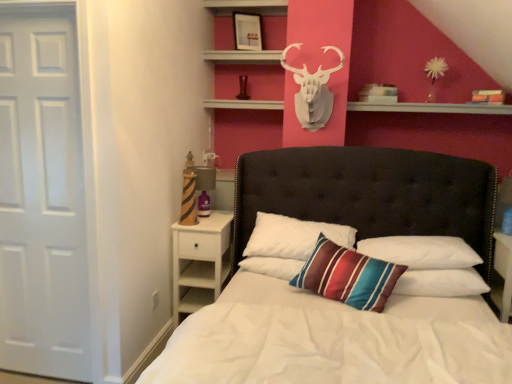
Question: From a real-world perspective, is white matte door at left on top of striped fabric pillow at center, marked as the 3th pillow in a left-to-right arrangement?

Choices:
 (A) no
 (B) yes

Answer: (B)

Question: Considering the relative sizes of white matte door at left and striped fabric pillow at center, marked as the 1th pillow in a right-to-left arrangement, in the image provided, is white matte door at left smaller than striped fabric pillow at center, marked as the 1th pillow in a right-to-left arrangement,?

Choices:
 (A) yes
 (B) no

Answer: (B)

Question: From the image's perspective, is white matte door at left under striped fabric pillow at center, marked as the 3th pillow in a left-to-right arrangement?

Choices:
 (A) yes
 (B) no

Answer: (B)

Question: Does white matte door at left have a lesser width compared to striped fabric pillow at center, marked as the 3th pillow in a left-to-right arrangement?

Choices:
 (A) yes
 (B) no

Answer: (A)

Question: Is white matte door at left to the right of striped fabric pillow at center, marked as the 3th pillow in a left-to-right arrangement, from the viewer's perspective?

Choices:
 (A) yes
 (B) no

Answer: (B)

Question: Considering the relative sizes of white matte door at left and striped fabric pillow at center, marked as the 1th pillow in a right-to-left arrangement, in the image provided, is white matte door at left taller than striped fabric pillow at center, marked as the 1th pillow in a right-to-left arrangement,?

Choices:
 (A) yes
 (B) no

Answer: (A)

Question: From the image's perspective, is striped fabric pillow at center, marked as the second pillow in a right-to-left arrangement, beneath striped fabric pillow at center, marked as the 3th pillow in a left-to-right arrangement?

Choices:
 (A) no
 (B) yes

Answer: (B)

Question: From a real-world perspective, is striped fabric pillow at center, marked as the second pillow in a right-to-left arrangement, located beneath striped fabric pillow at center, marked as the 3th pillow in a left-to-right arrangement?

Choices:
 (A) no
 (B) yes

Answer: (B)

Question: Considering the relative positions of striped fabric pillow at center, the 2th pillow from the left, and striped fabric pillow at center, marked as the 1th pillow in a right-to-left arrangement, in the image provided, is striped fabric pillow at center, the 2th pillow from the left, to the right of striped fabric pillow at center, marked as the 1th pillow in a right-to-left arrangement, from the viewer's perspective?

Choices:
 (A) yes
 (B) no

Answer: (B)

Question: Can you confirm if striped fabric pillow at center, the 2th pillow from the left, is positioned to the left of striped fabric pillow at center, marked as the 3th pillow in a left-to-right arrangement?

Choices:
 (A) yes
 (B) no

Answer: (A)

Question: Considering the relative sizes of striped fabric pillow at center, the 2th pillow from the left, and striped fabric pillow at center, marked as the 3th pillow in a left-to-right arrangement, in the image provided, is striped fabric pillow at center, the 2th pillow from the left, taller than striped fabric pillow at center, marked as the 3th pillow in a left-to-right arrangement,?

Choices:
 (A) no
 (B) yes

Answer: (B)

Question: Is striped fabric pillow at center, the 2th pillow from the left, turned away from striped fabric pillow at center, marked as the 1th pillow in a right-to-left arrangement?

Choices:
 (A) no
 (B) yes

Answer: (B)

Question: Is white wood nightstand at lower left closer to camera compared to striped fabric pillow at center, marked as the 3th pillow in a left-to-right arrangement?

Choices:
 (A) no
 (B) yes

Answer: (A)